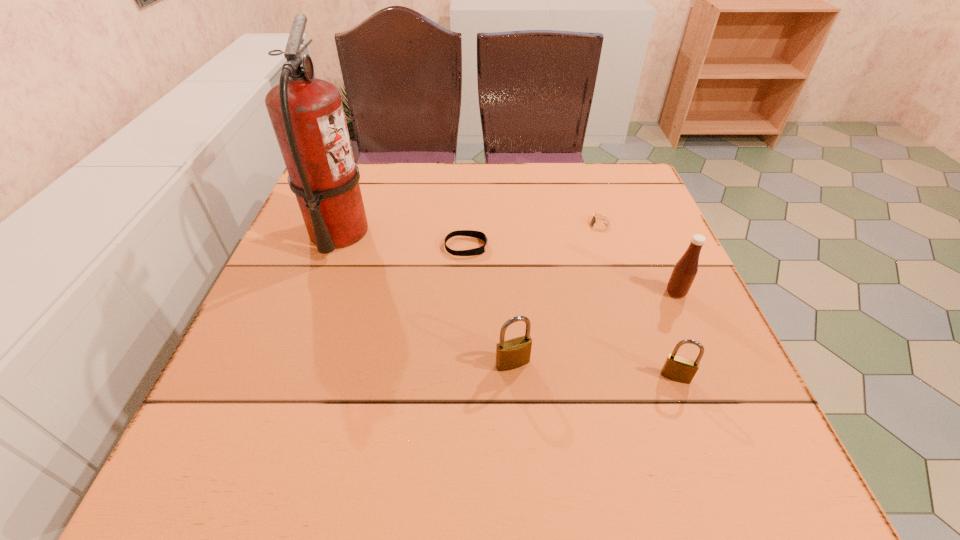
The width and height of the screenshot is (960, 540). I want to click on vacant position in the image that satisfies the following two spatial constraints: 1. on the face of the watch; 2. on the right side of the second tallest object, so click(x=621, y=293).

Where is `free space that satisfies the following two spatial constraints: 1. on the display of the fourth shortest object; 2. on the right side of the wristband`? free space that satisfies the following two spatial constraints: 1. on the display of the fourth shortest object; 2. on the right side of the wristband is located at coordinates (463, 363).